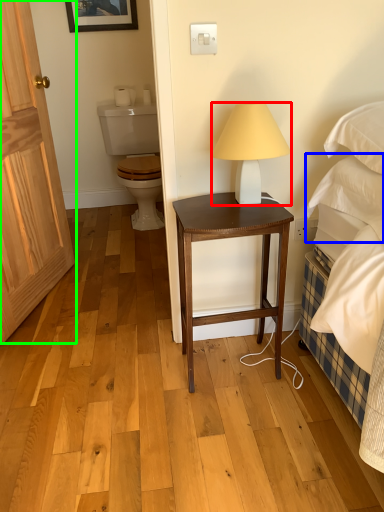
Question: Which is farther away from lamp (highlighted by a red box)? pillow (highlighted by a blue box) or door (highlighted by a green box)?

Choices:
 (A) pillow
 (B) door

Answer: (B)